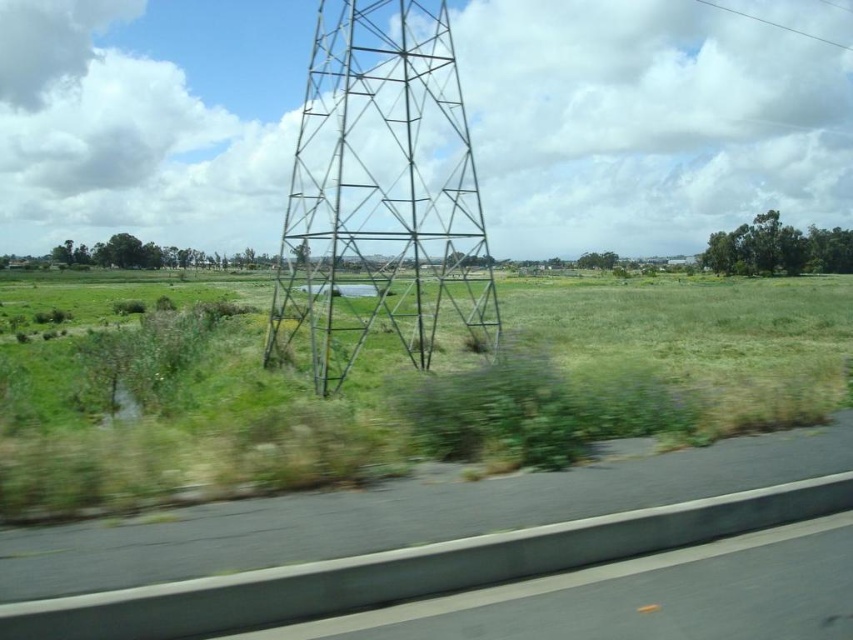
Question: Is metallic grid tower at center bigger than gray asphalt highway at lower left?

Choices:
 (A) yes
 (B) no

Answer: (A)

Question: Which of the following is the farthest from the observer?

Choices:
 (A) clear wire at upper right
 (B) gray asphalt highway at lower left
 (C) metallic grid tower at center

Answer: (A)

Question: Which point is closer to the camera taking this photo?

Choices:
 (A) (332, 500)
 (B) (373, 328)
 (C) (793, 29)

Answer: (A)

Question: In this image, where is metallic grid tower at center located relative to clear wire at upper right?

Choices:
 (A) below
 (B) above

Answer: (A)

Question: Can you confirm if metallic grid tower at center is smaller than gray asphalt highway at lower left?

Choices:
 (A) no
 (B) yes

Answer: (A)

Question: Which object appears farthest from the camera in this image?

Choices:
 (A) gray asphalt highway at lower left
 (B) metallic grid tower at center

Answer: (B)